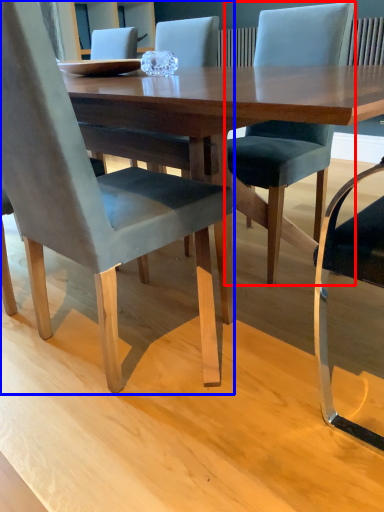
Question: Which point is further to the camera, chair (highlighted by a red box) or chair (highlighted by a blue box)?

Choices:
 (A) chair
 (B) chair

Answer: (A)